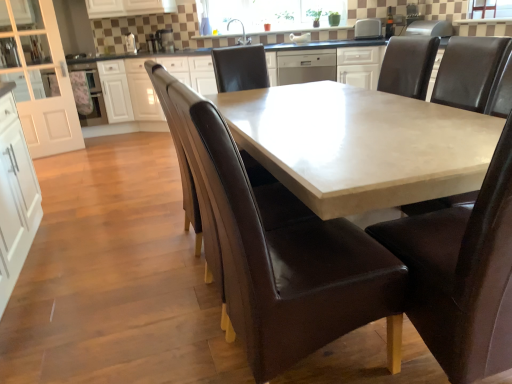
In order to face brown leather chair at center, which appears as the 3th chair when viewed from the right, should I rotate leftwards or rightwards?

It's best to rotate right around 5.112 degrees.

Identify the location of white glossy cabinet at left, which appears as the first cabinetry when viewed from the left. The image size is (512, 384). (39, 76).

What do you see at coordinates (462, 274) in the screenshot? I see `brown leather chair at center, acting as the 2th chair starting from the right` at bounding box center [462, 274].

Where is `metallic stainless steel toaster at upper center, placed as the second appliance when sorted from front to back`? The height and width of the screenshot is (384, 512). metallic stainless steel toaster at upper center, placed as the second appliance when sorted from front to back is located at coordinates (130, 43).

Image resolution: width=512 pixels, height=384 pixels. Find the location of `white glossy cabinet at center, which is the 2th cabinetry from left to right`. white glossy cabinet at center, which is the 2th cabinetry from left to right is located at coordinates (359, 66).

This screenshot has width=512, height=384. Describe the element at coordinates (471, 72) in the screenshot. I see `brown leather chair at center, the first chair from the right` at that location.

In order to click on matte glass window screen at upper center, acting as the 2th window screen starting from the right in this screenshot , I will do `click(271, 15)`.

The width and height of the screenshot is (512, 384). Find the location of `brown leather chair at center, which appears as the 1th chair when viewed from the left`. brown leather chair at center, which appears as the 1th chair when viewed from the left is located at coordinates (280, 252).

From a real-world perspective, which object rests below the other?

In real-world perspective, white glossy cabinet at center, which is the 2th cabinetry from left to right, is lower.

In terms of size, does matte glass window screen at upper center, acting as the 2th window screen starting from the right, appear bigger or smaller than white glossy cabinet at center, acting as the first cabinetry starting from the right?

Considering their sizes, matte glass window screen at upper center, acting as the 2th window screen starting from the right, takes up less space than white glossy cabinet at center, acting as the first cabinetry starting from the right.

Between matte glass window screen at upper center, acting as the 2th window screen starting from the right, and white glossy cabinet at center, which is the 2th cabinetry from left to right, which one appears on the left side from the viewer's perspective?

From the viewer's perspective, matte glass window screen at upper center, acting as the 2th window screen starting from the right, appears more on the left side.

From the image's perspective, which is below, matte glass window screen at upper center, the first window screen viewed from the back, or white glossy cabinet at center, which is the 2th cabinetry from left to right?

white glossy cabinet at center, which is the 2th cabinetry from left to right, appears lower in the image.

Is satin silver dishwasher at center bigger than white glossy cabinet at left, the second cabinetry viewed from the right?

Yes, satin silver dishwasher at center is bigger than white glossy cabinet at left, the second cabinetry viewed from the right.

Is satin silver dishwasher at center looking in the opposite direction of white glossy cabinet at left, the second cabinetry viewed from the right?

satin silver dishwasher at center does not have its back to white glossy cabinet at left, the second cabinetry viewed from the right.

From the picture: From a real-world perspective, who is located lower, satin silver dishwasher at center or white glossy cabinet at left, the second cabinetry viewed from the right?

satin silver dishwasher at center.

Are satin silver dishwasher at center and white glossy cabinet at left, the second cabinetry viewed from the right, beside each other?

No, satin silver dishwasher at center is not next to white glossy cabinet at left, the second cabinetry viewed from the right.

Does point (286, 74) come closer to viewer compared to point (219, 250)?

That is False.

Consider the image. Could you tell me if satin silver dishwasher at center is turned towards brown leather armchair at center?

Yes, satin silver dishwasher at center is turned towards brown leather armchair at center.

How different are the orientations of satin silver dishwasher at center and brown leather armchair at center in degrees?

126 degrees separate the facing orientations of satin silver dishwasher at center and brown leather armchair at center.

Can you confirm if satin silver dishwasher at center is taller than brown leather armchair at center?

In fact, satin silver dishwasher at center may be shorter than brown leather armchair at center.

From a real-world perspective, is white plastic toaster at upper center, the 1th appliance in the front-to-back sequence, positioned above or below matte glass window screen at upper center, the 2th window screen positioned from the bottom?

In terms of real-world spatial position, white plastic toaster at upper center, the 1th appliance in the front-to-back sequence, is below matte glass window screen at upper center, the 2th window screen positioned from the bottom.

What are the coordinates of `window screen that is above the white plastic toaster at upper center, marked as the 1th appliance in a right-to-left arrangement (from the image's perspective)` in the screenshot? It's located at (271, 15).

Does white plastic toaster at upper center, the 1th appliance in the front-to-back sequence, appear on the right side of matte glass window screen at upper center, acting as the 2th window screen starting from the right?

Yes.

Is white plastic toaster at upper center, the 1th appliance in the front-to-back sequence, beside matte glass window screen at upper center, the 2th window screen positioned from the front?

No, white plastic toaster at upper center, the 1th appliance in the front-to-back sequence, is not making contact with matte glass window screen at upper center, the 2th window screen positioned from the front.

How many degrees apart are the facing directions of clear glass window screen at upper center, the 2th window screen positioned from the left, and brown leather chair at center, marked as the second chair in a left-to-right arrangement?

The angle between the facing direction of clear glass window screen at upper center, the 2th window screen positioned from the left, and the facing direction of brown leather chair at center, marked as the second chair in a left-to-right arrangement, is 88.7 degrees.

Is there a large distance between clear glass window screen at upper center, which ranks as the 1th window screen in right-to-left order, and brown leather chair at center, acting as the 2th chair starting from the right?

Indeed, clear glass window screen at upper center, which ranks as the 1th window screen in right-to-left order, is not near brown leather chair at center, acting as the 2th chair starting from the right.

Between clear glass window screen at upper center, which is the first window screen from bottom to top, and brown leather chair at center, marked as the second chair in a left-to-right arrangement, which one appears on the right side from the viewer's perspective?

From the viewer's perspective, clear glass window screen at upper center, which is the first window screen from bottom to top, appears more on the right side.

Looking at their sizes, would you say clear glass window screen at upper center, which is the second window screen in back-to-front order, is wider or thinner than brown leather chair at center, acting as the 2th chair starting from the right?

Considering their sizes, clear glass window screen at upper center, which is the second window screen in back-to-front order, looks slimmer than brown leather chair at center, acting as the 2th chair starting from the right.

From their relative heights in the image, would you say satin silver toaster at upper center, marked as the 4th appliance in a front-to-back arrangement, is taller or shorter than brown leather chair at center, which appears as the 1th chair when viewed from the left?

satin silver toaster at upper center, marked as the 4th appliance in a front-to-back arrangement, is shorter than brown leather chair at center, which appears as the 1th chair when viewed from the left.

Is satin silver toaster at upper center, marked as the 4th appliance in a front-to-back arrangement, not close to brown leather chair at center, which appears as the 3th chair when viewed from the right?

Yes, satin silver toaster at upper center, marked as the 4th appliance in a front-to-back arrangement, and brown leather chair at center, which appears as the 3th chair when viewed from the right, are located far from each other.

Which is correct: satin silver toaster at upper center, acting as the 1th appliance starting from the back, is inside brown leather chair at center, which appears as the 3th chair when viewed from the right, or outside of it?

satin silver toaster at upper center, acting as the 1th appliance starting from the back, cannot be found inside brown leather chair at center, which appears as the 3th chair when viewed from the right.

Which is more to the left, satin silver toaster at upper center, which is the 2th appliance from left to right, or brown leather chair at center, which appears as the 3th chair when viewed from the right?

satin silver toaster at upper center, which is the 2th appliance from left to right, is more to the left.

Which object is closer to the camera, white glossy cabinet at left, the second cabinetry viewed from the right, or white plastic toaster at upper center, marked as the 1th appliance in a right-to-left arrangement?

white glossy cabinet at left, the second cabinetry viewed from the right.

Consider the image. Is white glossy cabinet at left, the second cabinetry viewed from the right, not near white plastic toaster at upper center, the 1th appliance in the front-to-back sequence?

Yes, white glossy cabinet at left, the second cabinetry viewed from the right, and white plastic toaster at upper center, the 1th appliance in the front-to-back sequence, are quite far apart.

Find the location of a particular element. The height and width of the screenshot is (384, 512). the 2nd cabinetry to the left when counting from the white plastic toaster at upper center, positioned as the fourth appliance in back-to-front order is located at coordinates tap(39, 76).

Does white glossy cabinet at left, the second cabinetry viewed from the right, have a lesser height compared to white plastic toaster at upper center, marked as the 1th appliance in a right-to-left arrangement?

No.

The height and width of the screenshot is (384, 512). In order to click on the 1st cabinetry in front of the matte glass window screen at upper center, the first window screen from the left, counting from the anchor's position in this screenshot , I will do `click(359, 66)`.

What are the coordinates of `cabinetry that appears above the satin silver dishwasher at center (from a real-world perspective)` in the screenshot? It's located at (39, 76).

Estimate the real-world distances between objects in this image. Which object is further from white glossy cabinet at left, the second cabinetry viewed from the right, satin silver toaster at upper center, arranged as the 3th appliance when viewed from the right, or matte glass window screen at upper center, the 2th window screen positioned from the front?

matte glass window screen at upper center, the 2th window screen positioned from the front, is positioned further to the anchor white glossy cabinet at left, the second cabinetry viewed from the right.

Looking at the image, which one is located closer to brown leather chair at center, the first chair from the right, clear glass window screen at upper center, which is the second window screen in back-to-front order, or metallic stainless steel toaster at upper center, placed as the second appliance when sorted from front to back?

clear glass window screen at upper center, which is the second window screen in back-to-front order.

Considering their positions, is white glossy cabinet at center, acting as the first cabinetry starting from the right, positioned closer to brown leather chair at center, marked as the second chair in a left-to-right arrangement, than satin silver toaster at upper center, acting as the 1th appliance starting from the back?

white glossy cabinet at center, acting as the first cabinetry starting from the right.

Based on their spatial positions, is satin silver dishwasher at center or brown leather chair at center, marked as the second chair in a left-to-right arrangement, closer to white glossy cabinet at center, which is the 2th cabinetry from left to right?

Among the two, satin silver dishwasher at center is located nearer to white glossy cabinet at center, which is the 2th cabinetry from left to right.

In the scene shown: Looking at the image, which one is located closer to white plastic toaster at upper center, positioned as the fourth appliance in back-to-front order, satin silver toaster at upper center, the third appliance viewed from the left, or satin silver dishwasher at center?

satin silver dishwasher at center is closer to white plastic toaster at upper center, positioned as the fourth appliance in back-to-front order.

Consider the image. Looking at the image, which one is located further to satin silver toaster at upper center, which is the 2th appliance from left to right, brown leather armchair at center or clear glass window screen at upper center, which is the first window screen from bottom to top?

brown leather armchair at center is further to satin silver toaster at upper center, which is the 2th appliance from left to right.

Looking at the image, which one is located closer to brown leather armchair at center, brown leather chair at center, acting as the 2th chair starting from the right, or white ceramic sink at upper center?

The object closer to brown leather armchair at center is brown leather chair at center, acting as the 2th chair starting from the right.

Based on their spatial positions, is white glossy cabinet at left, which appears as the first cabinetry when viewed from the left, or white ceramic sink at upper center closer to brown leather chair at center, the first chair from the right?

Based on the image, white ceramic sink at upper center appears to be nearer to brown leather chair at center, the first chair from the right.

The image size is (512, 384). Find the location of `dish washer between white ceramic sink at upper center and white glossy cabinet at center, acting as the first cabinetry starting from the right`. dish washer between white ceramic sink at upper center and white glossy cabinet at center, acting as the first cabinetry starting from the right is located at coordinates (306, 66).

Find the location of `sink between brown leather chair at center, which is the 3th chair in left-to-right order, and satin silver toaster at upper center, which is counted as the 3th appliance, starting from the front, along the z-axis`. sink between brown leather chair at center, which is the 3th chair in left-to-right order, and satin silver toaster at upper center, which is counted as the 3th appliance, starting from the front, along the z-axis is located at coordinates (242, 33).

You are a GUI agent. You are given a task and a screenshot of the screen. Output one action in this format:
    pyautogui.click(x=<x>, y=<y>)
    Task: Click on the sink between satin silver toaster at upper center, the third appliance viewed from the left, and white glossy cabinet at center, which is the 2th cabinetry from left to right
    This screenshot has width=512, height=384.
    Given the screenshot: What is the action you would take?
    pyautogui.click(x=242, y=33)

At what (x,y) coordinates should I click in order to perform the action: click on window screen situated between white glossy cabinet at left, which appears as the first cabinetry when viewed from the left, and white plastic toaster at upper center, which ranks as the fourth appliance in left-to-right order, from left to right. Please return your answer as a coordinate pair (x, y). The height and width of the screenshot is (384, 512). Looking at the image, I should click on (271, 15).